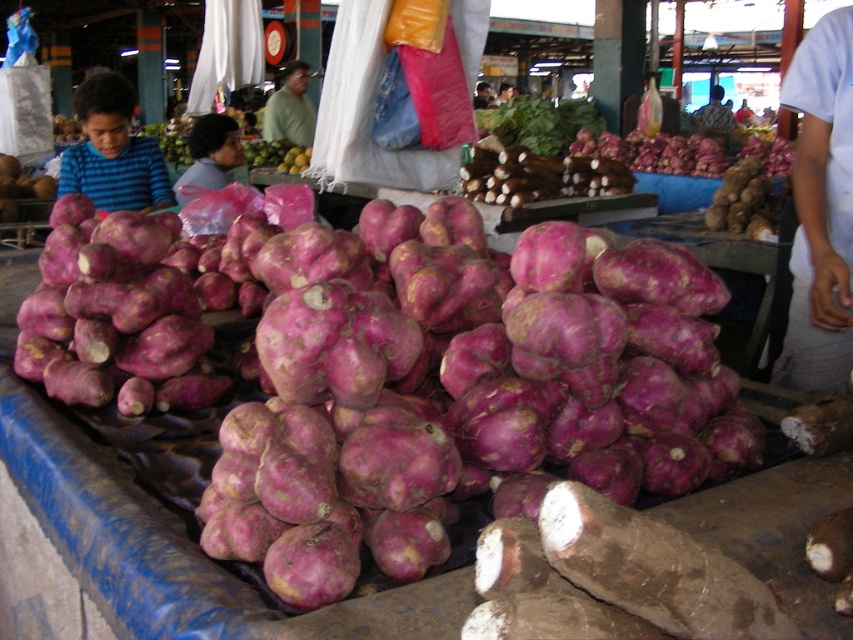
Is point (497, 172) closer to viewer compared to point (294, 76)?

Yes, it is in front of point (294, 76).

Is brown rough root at center positioned before green matte shirt at center?

Yes, brown rough root at center is in front of green matte shirt at center.

Who is more forward, (577,172) or (299,81)?

Positioned in front is point (577,172).

This screenshot has width=853, height=640. Find the location of `brown rough root at center`. brown rough root at center is located at coordinates (538, 177).

Is brown rough root at center positioned in front of green matte mango at center?

That is True.

Who is positioned more to the right, brown rough root at center or green matte mango at center?

Positioned to the right is brown rough root at center.

Between point (486, 189) and point (286, 156), which one is positioned in front?

Point (486, 189) is in front.

What are the coordinates of `brown rough root at center` in the screenshot? It's located at (538, 177).

Measure the distance from blue striped shirt at left to brown rough root at center.

The distance of blue striped shirt at left from brown rough root at center is 1.72 meters.

At what (x,y) coordinates should I click in order to perform the action: click on blue striped shirt at left. Please return your answer as a coordinate pair (x, y). Looking at the image, I should click on (112, 150).

At what (x,y) coordinates should I click in order to perform the action: click on blue striped shirt at left. Please return your answer as a coordinate pair (x, y). The image size is (853, 640). Looking at the image, I should click on (112, 150).

Identify the location of blue striped shirt at left. Image resolution: width=853 pixels, height=640 pixels. (112, 150).